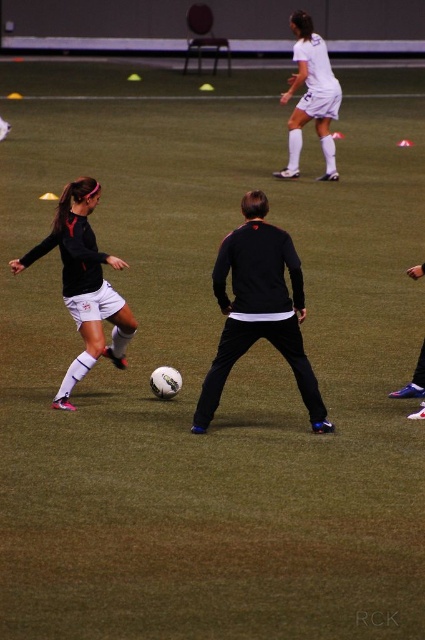
Based on the photo, which of these two, black matte jacket at center or matte black soccer ball at center, stands shorter?

Standing shorter between the two is matte black soccer ball at center.

Find the location of a particular element. Image resolution: width=425 pixels, height=640 pixels. black matte jacket at center is located at coordinates (258, 308).

At what (x,y) coordinates should I click in order to perform the action: click on black matte jacket at center. Please return your answer as a coordinate pair (x, y). This screenshot has height=640, width=425. Looking at the image, I should click on (258, 308).

Who is taller, black matte jacket at center or white matte soccer player at upper center?

Standing taller between the two is black matte jacket at center.

Can you confirm if black matte jacket at center is taller than white matte soccer player at upper center?

Indeed, black matte jacket at center has a greater height compared to white matte soccer player at upper center.

This screenshot has height=640, width=425. Find the location of `black matte jacket at center`. black matte jacket at center is located at coordinates (258, 308).

Does matte black soccer ball at center come behind white matte soccer player at upper center?

No, it is in front of white matte soccer player at upper center.

Is matte black soccer ball at center closer to camera compared to white matte soccer player at upper center?

That is True.

Who is more forward, (64, 276) or (322, 54)?

Point (64, 276) is more forward.

Identify the location of matte black soccer ball at center. The width and height of the screenshot is (425, 640). (84, 284).